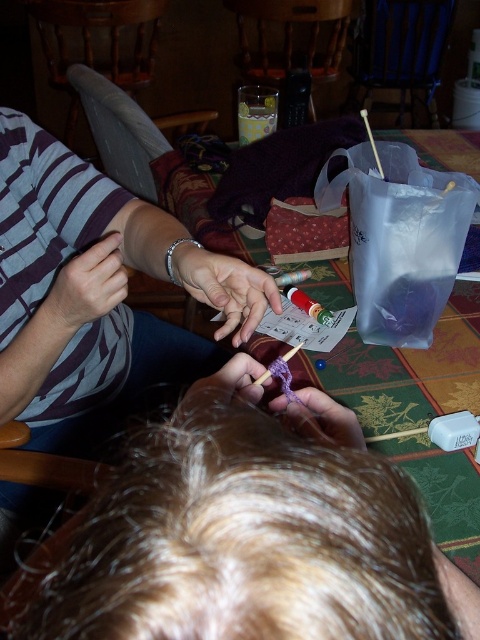
Question: Based on their relative distances, which object is nearer to the silver metallic bracelet at center?

Choices:
 (A) striped fabric shirt at left
 (B) green fabric table at center

Answer: (A)

Question: Where is striped fabric shirt at left located in relation to transparent plastic bag at upper right in the image?

Choices:
 (A) left
 (B) right

Answer: (A)

Question: In this image, where is silver metallic bracelet at center located relative to purple yarn at center?

Choices:
 (A) below
 (B) above

Answer: (B)

Question: Which object appears closest to the camera in this image?

Choices:
 (A) silver metallic bracelet at center
 (B) purple yarn at center
 (C) transparent plastic bag at upper right

Answer: (B)

Question: Which of the following is the farthest from the observer?

Choices:
 (A) (471, 477)
 (B) (87, 273)
 (C) (54, 273)

Answer: (C)

Question: Is transparent plastic bag at upper right further to the viewer compared to matte skin hand at center?

Choices:
 (A) no
 (B) yes

Answer: (B)